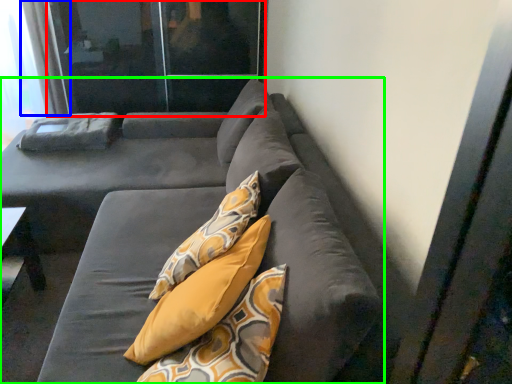
Question: Based on their relative distances, which object is nearer to screen door (highlighted by a red box)? Choose from curtain (highlighted by a blue box) and studio couch (highlighted by a green box).

Choices:
 (A) curtain
 (B) studio couch

Answer: (A)